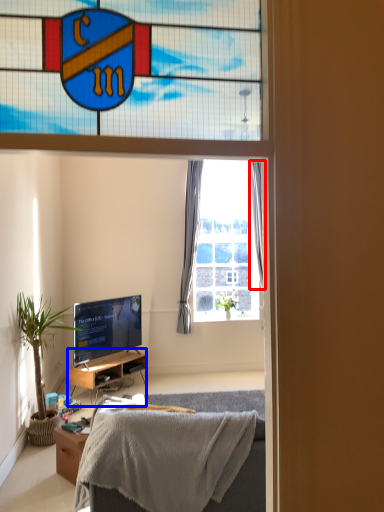
Question: Among these objects, which one is nearest to the camera, curtain (highlighted by a red box) or cabinetry (highlighted by a blue box)?

Choices:
 (A) curtain
 (B) cabinetry

Answer: (B)